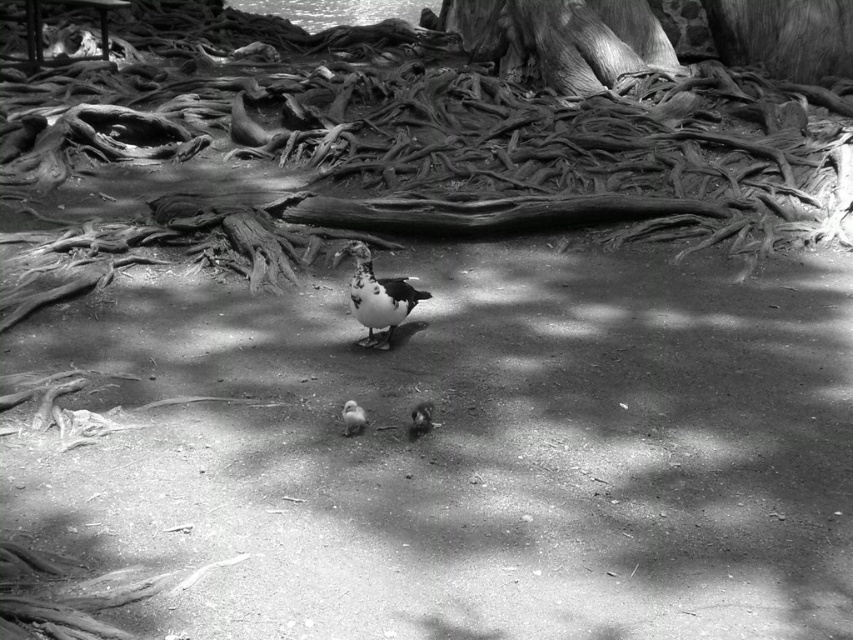
Question: Can you confirm if rough bark tree trunk at upper center is positioned to the right of dark gray matte pigeon at center?

Choices:
 (A) yes
 (B) no

Answer: (A)

Question: Is rough bark tree trunk at upper center to the right of white downy duckling at center from the viewer's perspective?

Choices:
 (A) yes
 (B) no

Answer: (A)

Question: Does dark gray matte pigeon at center appear over white fluffy pigeon at center?

Choices:
 (A) yes
 (B) no

Answer: (A)

Question: Which object is positioned closest to the dark gray matte pigeon at center?

Choices:
 (A) white downy duckling at center
 (B) white fluffy pigeon at center

Answer: (B)

Question: Which object is positioned farthest from the dark gray matte pigeon at center?

Choices:
 (A) white downy duckling at center
 (B) rough bark tree trunk at upper center
 (C) white fluffy pigeon at center

Answer: (B)

Question: Which point appears closest to the camera in this image?

Choices:
 (A) (564, 52)
 (B) (387, 292)

Answer: (B)